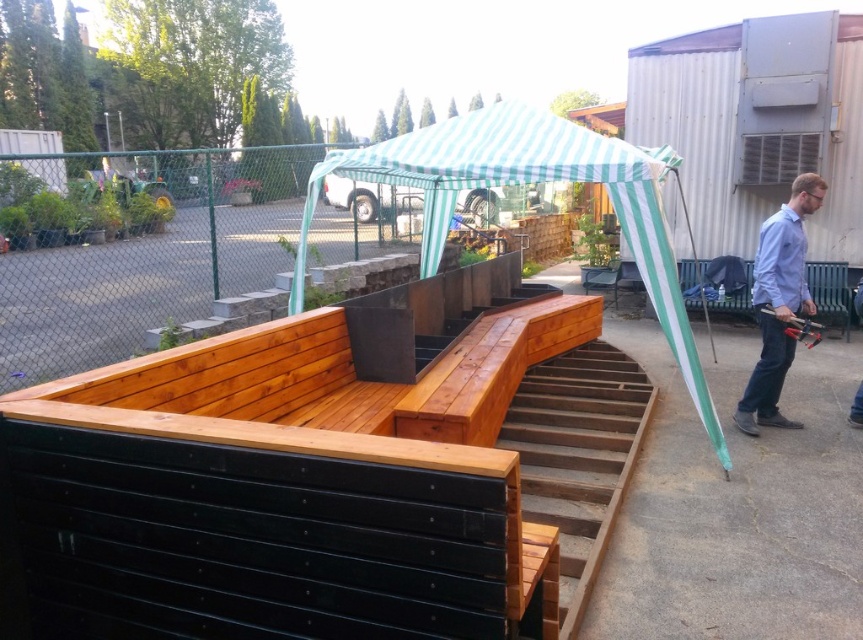
You are standing at the base of the wooden stairs at lower right and want to walk towards the green striped canopy at center. In which direction should you move?

You should move to the left to reach the green striped canopy at center because it is positioned to the left of the wooden stairs at lower right.

You are standing in the outdoor area and want to take a photo of the light blue shirt at right without the green striped canopy at center appearing in the background. Is this possible?

The green striped canopy at center is in front of the light blue shirt at right, so you cannot take a photo of the light blue shirt at right without the green striped canopy at center appearing in the background.